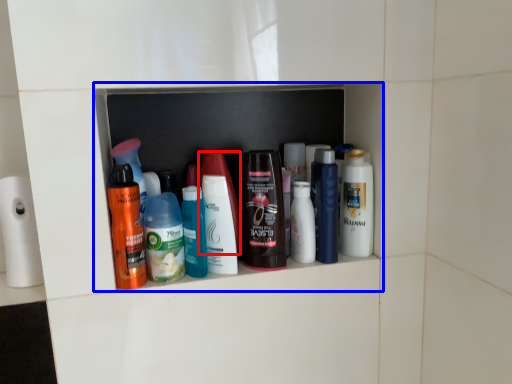
Question: Which object is closer to the camera taking this photo, toiletry (highlighted by a red box) or shelf (highlighted by a blue box)?

Choices:
 (A) toiletry
 (B) shelf

Answer: (A)